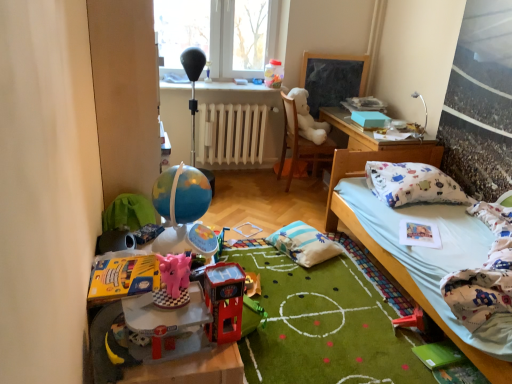
Where is `empty space that is ontop of white matte radiator at center (from a real-world perspective)`? empty space that is ontop of white matte radiator at center (from a real-world perspective) is located at coordinates (232, 99).